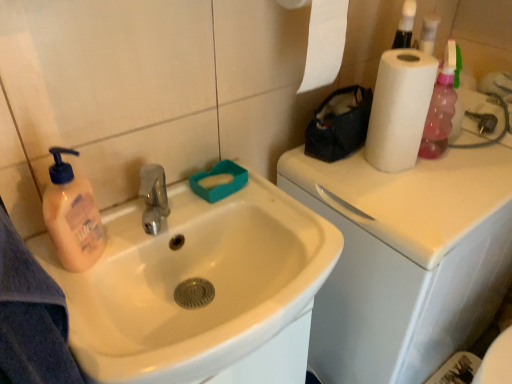
Question: Does white glossy sink at left have a lesser height compared to white matte paper towel at upper right?

Choices:
 (A) no
 (B) yes

Answer: (A)

Question: Considering the relative sizes of white glossy sink at left and white matte paper towel at upper right in the image provided, is white glossy sink at left smaller than white matte paper towel at upper right?

Choices:
 (A) no
 (B) yes

Answer: (A)

Question: Are white glossy sink at left and white matte paper towel at upper right located far from each other?

Choices:
 (A) yes
 (B) no

Answer: (B)

Question: Does white glossy sink at left contain white matte paper towel at upper right?

Choices:
 (A) no
 (B) yes

Answer: (A)

Question: Is the depth of white glossy sink at left greater than that of white matte paper towel at upper right?

Choices:
 (A) no
 (B) yes

Answer: (A)

Question: Looking at their shapes, would you say white glossy counter top at upper right is wider or thinner than white matte paper towel at upper right?

Choices:
 (A) thin
 (B) wide

Answer: (B)

Question: From a real-world perspective, relative to white matte paper towel at upper right, is white glossy counter top at upper right vertically above or below?

Choices:
 (A) above
 (B) below

Answer: (B)

Question: Does point (394, 289) appear closer or farther from the camera than point (398, 117)?

Choices:
 (A) farther
 (B) closer

Answer: (B)

Question: In the image, is white glossy counter top at upper right on the left side or the right side of white matte paper towel at upper right?

Choices:
 (A) left
 (B) right

Answer: (B)

Question: Relative to white glossy sink at left, is white glossy counter top at upper right in front or behind?

Choices:
 (A) front
 (B) behind

Answer: (B)

Question: Based on their sizes in the image, would you say white glossy counter top at upper right is bigger or smaller than white glossy sink at left?

Choices:
 (A) big
 (B) small

Answer: (A)

Question: Looking at their shapes, would you say white glossy counter top at upper right is wider or thinner than white glossy sink at left?

Choices:
 (A) thin
 (B) wide

Answer: (B)

Question: Considering the positions of white glossy counter top at upper right and white glossy sink at left in the image, is white glossy counter top at upper right taller or shorter than white glossy sink at left?

Choices:
 (A) tall
 (B) short

Answer: (A)

Question: Based on their positions, is white glossy sink at left located to the left or right of white matte paper towel at upper right?

Choices:
 (A) left
 (B) right

Answer: (A)

Question: From the image's perspective, is white glossy sink at left located above or below white matte paper towel at upper right?

Choices:
 (A) above
 (B) below

Answer: (B)